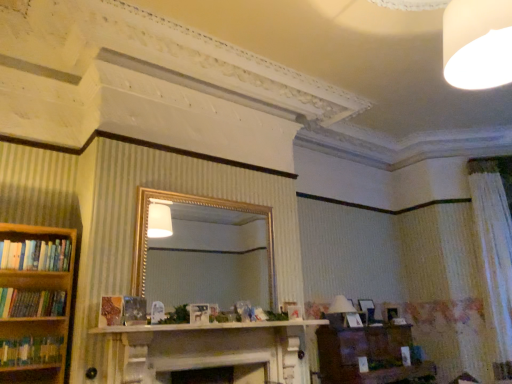
Question: Can you confirm if white frosted bulb at upper right is positioned to the right of brown wooden vanity at lower right?

Choices:
 (A) no
 (B) yes

Answer: (A)

Question: From a real-world perspective, is white frosted bulb at upper right below brown wooden vanity at lower right?

Choices:
 (A) yes
 (B) no

Answer: (B)

Question: Does white frosted bulb at upper right appear on the left side of brown wooden vanity at lower right?

Choices:
 (A) yes
 (B) no

Answer: (A)

Question: Is white frosted bulb at upper right wider than brown wooden vanity at lower right?

Choices:
 (A) yes
 (B) no

Answer: (B)

Question: Is white frosted bulb at upper right located outside brown wooden vanity at lower right?

Choices:
 (A) no
 (B) yes

Answer: (B)

Question: Can you confirm if white frosted bulb at upper right is smaller than brown wooden vanity at lower right?

Choices:
 (A) yes
 (B) no

Answer: (A)

Question: Is white frosted bulb at upper right thinner than white textured curtain at right?

Choices:
 (A) yes
 (B) no

Answer: (B)

Question: Is white frosted bulb at upper right taller than white textured curtain at right?

Choices:
 (A) no
 (B) yes

Answer: (A)

Question: Is the position of white frosted bulb at upper right less distant than that of white textured curtain at right?

Choices:
 (A) no
 (B) yes

Answer: (B)

Question: Considering the relative sizes of white frosted bulb at upper right and white textured curtain at right in the image provided, is white frosted bulb at upper right smaller than white textured curtain at right?

Choices:
 (A) no
 (B) yes

Answer: (B)

Question: Is white frosted bulb at upper right positioned with its back to white textured curtain at right?

Choices:
 (A) no
 (B) yes

Answer: (A)

Question: Is white frosted bulb at upper right at the left side of white textured curtain at right?

Choices:
 (A) yes
 (B) no

Answer: (A)

Question: Can you confirm if white textured curtain at right is bigger than brown wooden vanity at lower right?

Choices:
 (A) no
 (B) yes

Answer: (A)